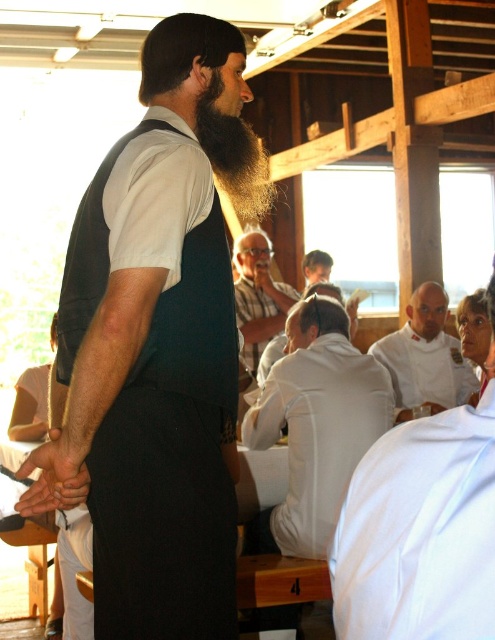
Between dark blue vest at center and striped cotton shirt at center, which one appears on the right side from the viewer's perspective?

From the viewer's perspective, striped cotton shirt at center appears more on the right side.

This screenshot has height=640, width=495. What do you see at coordinates (156, 348) in the screenshot?
I see `dark blue vest at center` at bounding box center [156, 348].

Identify the location of dark blue vest at center. The image size is (495, 640). (156, 348).

Is striped cotton shirt at center closer to the viewer compared to smooth brown hair at center?

Yes.

Who is more forward, (257, 320) or (319, 257)?

Point (257, 320)

The height and width of the screenshot is (640, 495). What are the coordinates of `striped cotton shirt at center` in the screenshot? It's located at (257, 296).

Which of these two, white matte shirt at center or brown fuzzy beard at center, stands shorter?

Standing shorter between the two is brown fuzzy beard at center.

Who is more distant from viewer, (383, 429) or (233, 195)?

Positioned behind is point (383, 429).

This screenshot has height=640, width=495. What are the coordinates of `white matte shirt at center` in the screenshot? It's located at (314, 426).